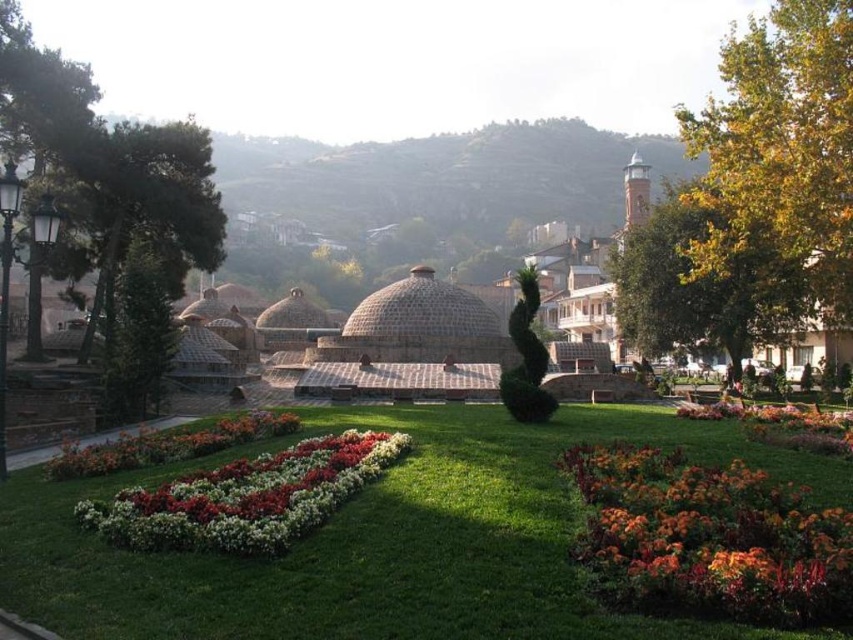
Question: Where is orange textured flowers at lower right located in relation to multicolored floral bed at center in the image?

Choices:
 (A) left
 (B) right

Answer: (B)

Question: Among these objects, which one is farthest from the camera?

Choices:
 (A) multicolored fabric flower at lower right
 (B) multicolored fabric flower bed at lower center
 (C) green grass at center

Answer: (A)

Question: Which is farther from the multicolored fabric flower bed at lower center?

Choices:
 (A) multicolored floral bed at center
 (B) orange textured flowers at lower right
 (C) multicolored fabric flower at lower right

Answer: (C)

Question: Is green grass at center above multicolored floral bed at center?

Choices:
 (A) no
 (B) yes

Answer: (A)

Question: Does green grass at center appear under multicolored floral bed at center?

Choices:
 (A) yes
 (B) no

Answer: (A)

Question: Which is farther from the multicolored fabric flower bed at lower center?

Choices:
 (A) green grass at center
 (B) multicolored fabric flower at lower right

Answer: (B)